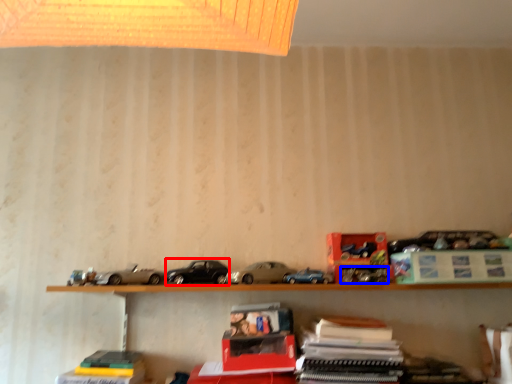
Question: Among these objects, which one is nearest to the camera, car (highlighted by a red box) or toy (highlighted by a blue box)?

Choices:
 (A) car
 (B) toy

Answer: (A)